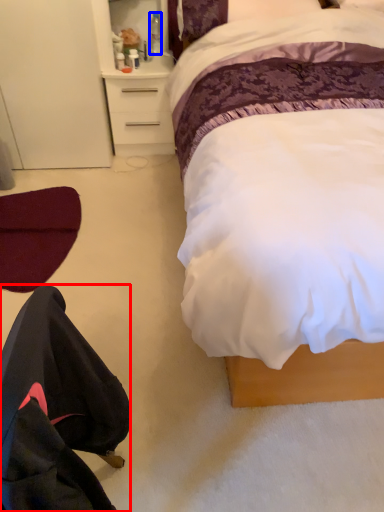
Question: Which point is further to the camera, robe (highlighted by a red box) or bottle (highlighted by a blue box)?

Choices:
 (A) robe
 (B) bottle

Answer: (B)